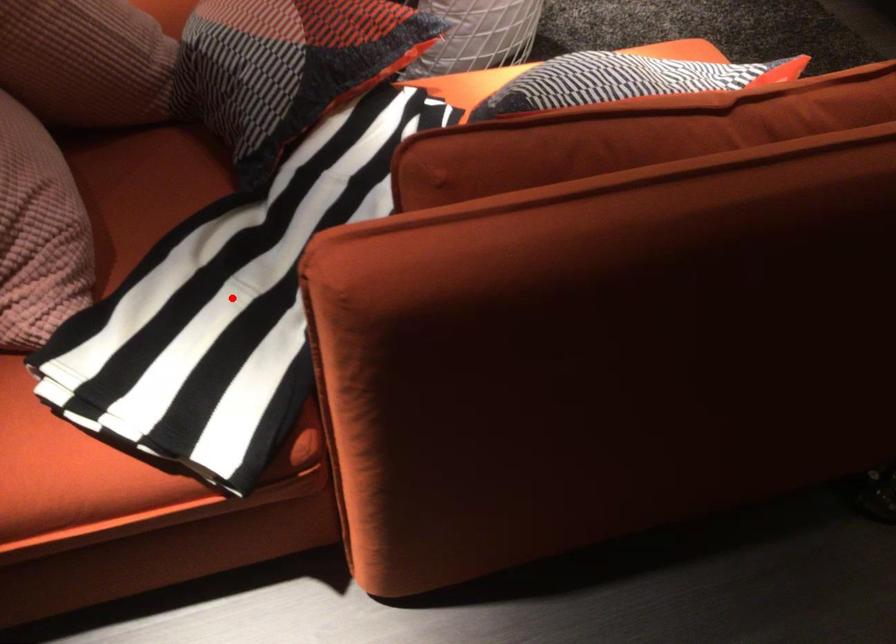
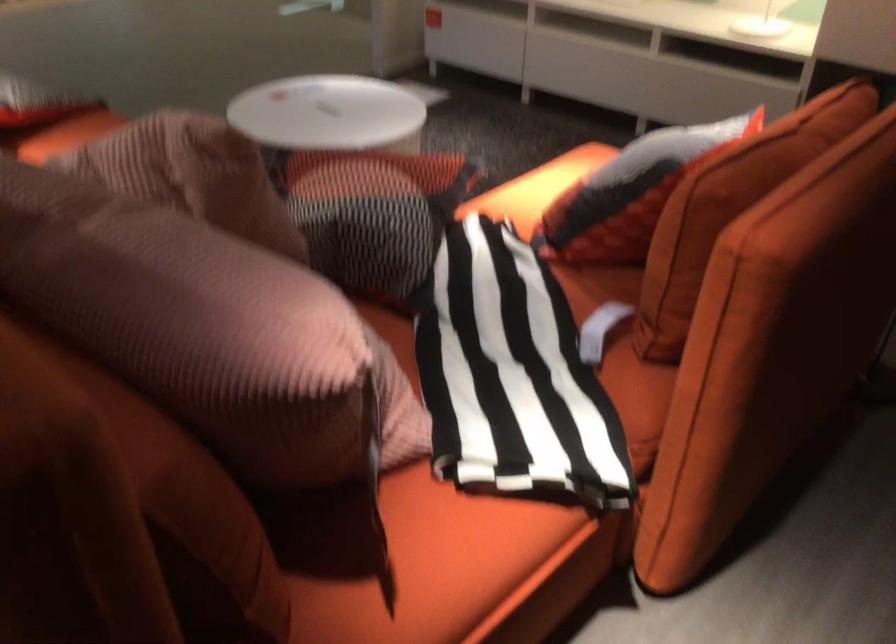
Question: A red point is marked in image1. In image2, is the corresponding 3D point closer to the camera or farther? Reply with the corresponding letter.

Choices:
 (A) The corresponding 3D point is closer.
 (B) The corresponding 3D point is farther.

Answer: (B)